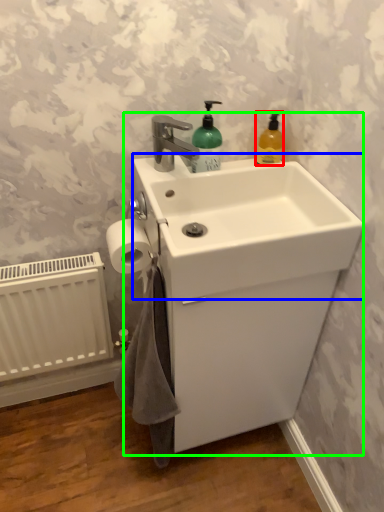
Question: Which is nearer to the cleaning product (highlighted by a red box)? counter top (highlighted by a blue box) or sink (highlighted by a green box).

Choices:
 (A) counter top
 (B) sink

Answer: (A)